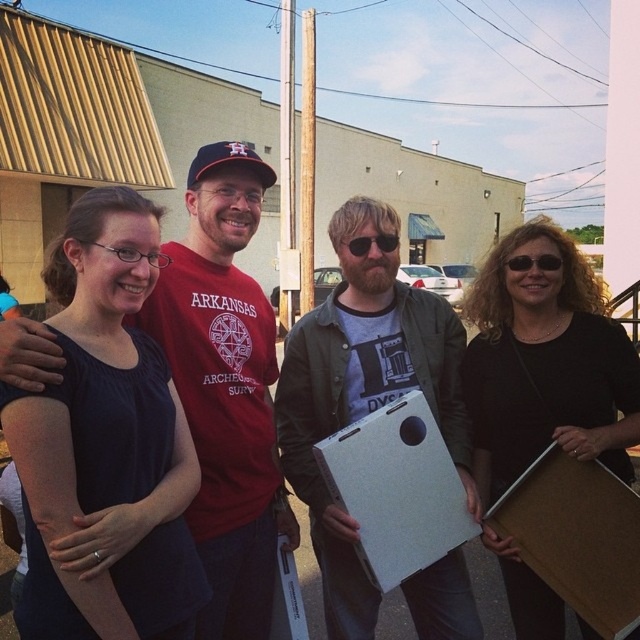
You are standing in front of a beige building with a corrugated metal roof and see a white matte cardboard box at center. Where exactly is the box located in relation to the group of four people?

The white matte cardboard box at center is located at point 0.766 on the x axis and 0.620 on the y axis.

You are a photographer trying to capture a closeup of the black plastic sunglasses at center without the brown cardboard at lower right appearing in the frame. Given their sizes, is this possible?

The brown cardboard at lower right is larger than the black plastic sunglasses at center, so it might block the view. Adjust your angle to ensure the smaller sunglasses are framed without the larger cardboard obstructing.